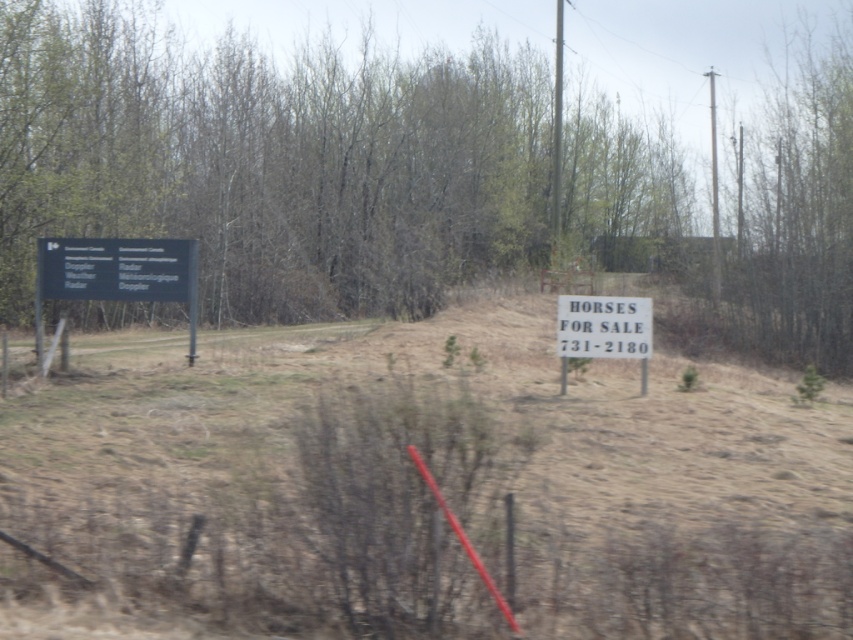
Question: Which is farther from the black plastic sign at left?

Choices:
 (A) green leafy tree at upper center
 (B) white paper sign at center

Answer: (A)

Question: Is the position of white paper sign at center more distant than that of white paper sign at right?

Choices:
 (A) yes
 (B) no

Answer: (B)

Question: Is green leafy tree at upper center to the left of white paper sign at right from the viewer's perspective?

Choices:
 (A) yes
 (B) no

Answer: (A)

Question: Which point is closer to the camera?

Choices:
 (A) (846, 80)
 (B) (61, 262)
 (C) (190, 452)

Answer: (C)

Question: Is white paper sign at center above black plastic sign at left?

Choices:
 (A) yes
 (B) no

Answer: (B)

Question: Which is nearer to the black plastic sign at left?

Choices:
 (A) white paper sign at center
 (B) green leafy tree at upper center
 (C) white paper sign at right

Answer: (C)